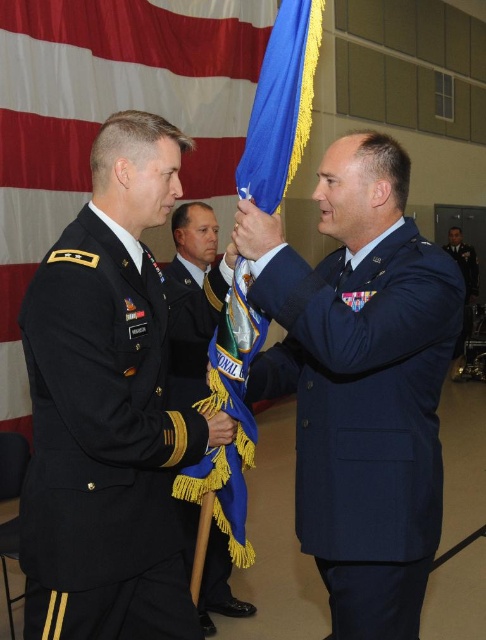
Question: Does navy blue fabric uniform at center appear on the left side of blue satin flag at center?

Choices:
 (A) yes
 (B) no

Answer: (B)

Question: Based on their relative distances, which object is farther from the blue fabric uniform at right?

Choices:
 (A) navy blue fabric uniform at center
 (B) blue satin flag at center
 (C) black matte uniform at left

Answer: (C)

Question: Can you confirm if navy blue fabric uniform at center is wider than blue fabric uniform at right?

Choices:
 (A) yes
 (B) no

Answer: (A)

Question: Considering the relative positions of black matte uniform at left and navy blue fabric uniform at center in the image provided, where is black matte uniform at left located with respect to navy blue fabric uniform at center?

Choices:
 (A) left
 (B) right

Answer: (A)

Question: Considering the real-world distances, which object is closest to the black matte uniform at left?

Choices:
 (A) blue satin flag at center
 (B) blue fabric uniform at right

Answer: (A)

Question: Which point is farther from the camera taking this photo?

Choices:
 (A) (180, 284)
 (B) (104, 628)
 (C) (391, 496)

Answer: (A)